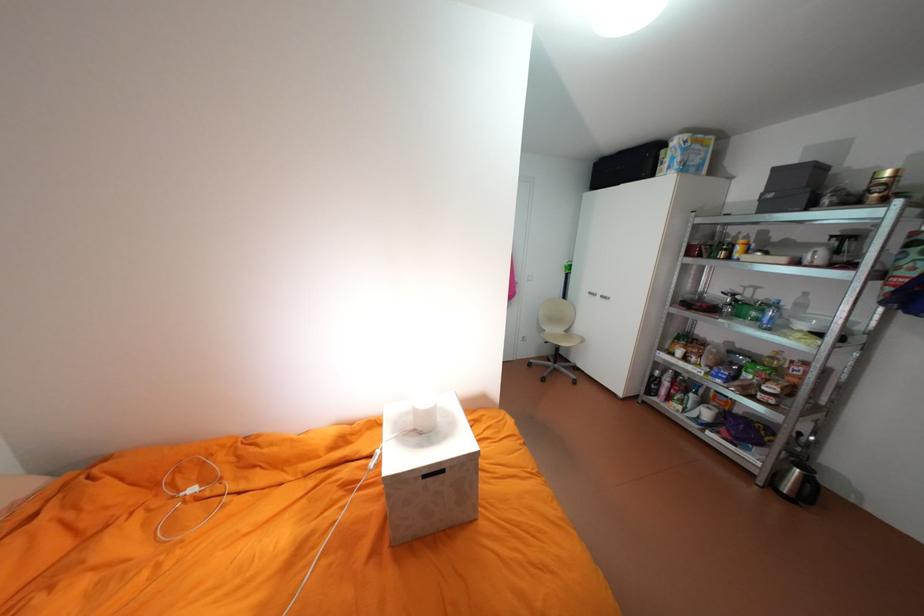
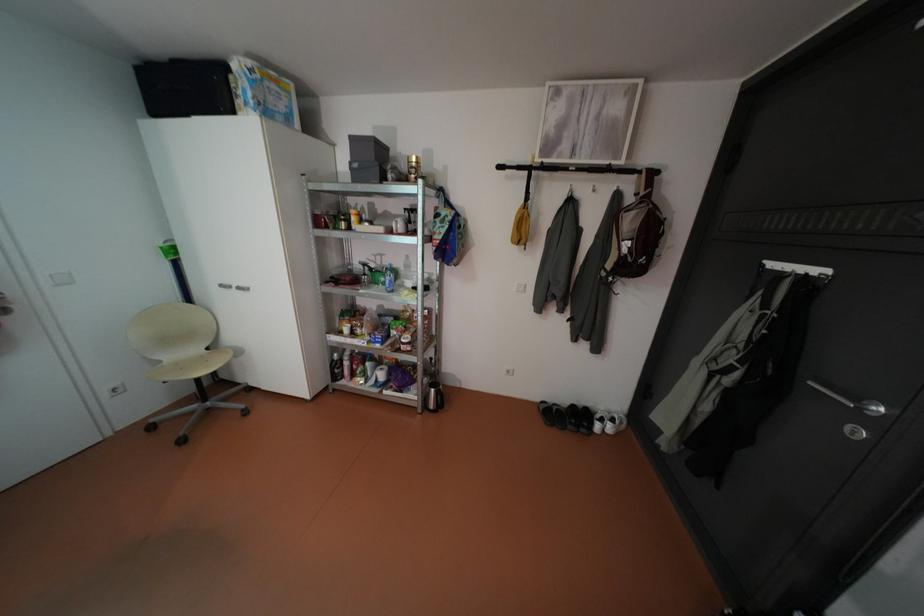
Where in the second image is the point corresponding to pixel 603 163 from the first image?

(147, 69)